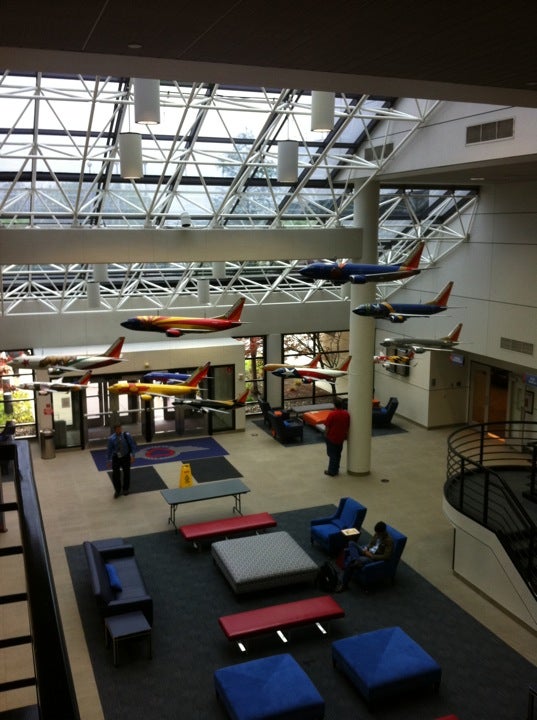
You are a GUI agent. You are given a task and a screenshot of the screen. Output one action in this format:
    pyautogui.click(x=<x>, y=<y>)
    Task: Click on the chair
    Image resolution: width=537 pixels, height=720 pixels.
    Given the screenshot: What is the action you would take?
    pyautogui.click(x=347, y=508), pyautogui.click(x=393, y=546)